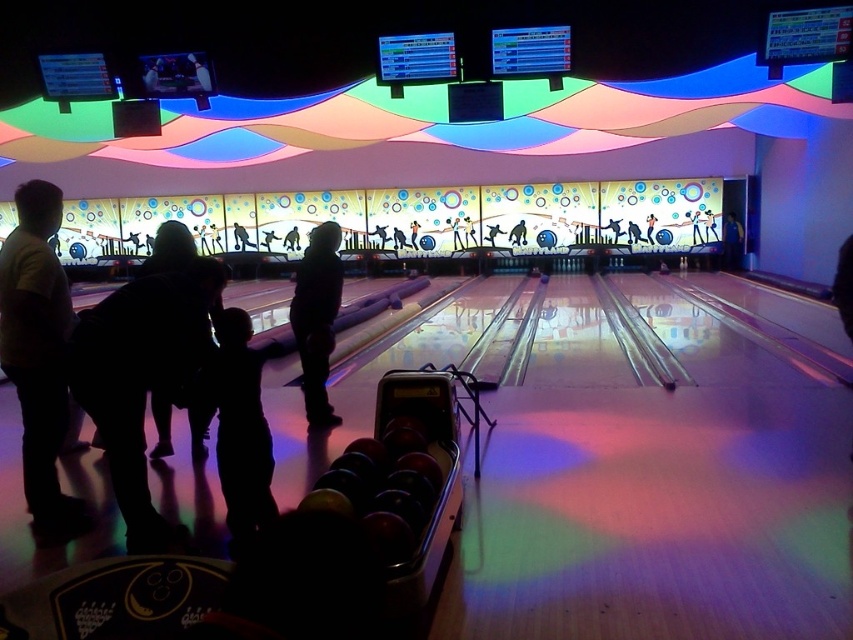
Can you confirm if dark clothing at left is positioned to the left of silhouette/shadow child at center?

Yes, dark clothing at left is to the left of silhouette/shadow child at center.

Is point (35, 280) less distant than point (253, 435)?

Yes.

This screenshot has width=853, height=640. What are the coordinates of `dark clothing at left` in the screenshot? It's located at (38, 353).

Locate an element on the screen. The height and width of the screenshot is (640, 853). dark clothing at left is located at coordinates (38, 353).

Between silhouette/shadow child at center and black matte clothing at center, which one has less height?

Standing shorter between the two is silhouette/shadow child at center.

Does silhouette/shadow child at center have a lesser width compared to black matte clothing at center?

No, silhouette/shadow child at center is not thinner than black matte clothing at center.

This screenshot has width=853, height=640. Describe the element at coordinates (241, 424) in the screenshot. I see `silhouette/shadow child at center` at that location.

At what (x,y) coordinates should I click in order to perform the action: click on silhouette/shadow child at center. Please return your answer as a coordinate pair (x, y). The height and width of the screenshot is (640, 853). Looking at the image, I should click on (241, 424).

Who is positioned more to the left, black matte bowling ball at left or black matte clothing at center?

From the viewer's perspective, black matte bowling ball at left appears more on the left side.

Is the position of black matte bowling ball at left less distant than that of black matte clothing at center?

Yes, black matte bowling ball at left is closer to the viewer.

Find the location of `black matte bowling ball at left`. black matte bowling ball at left is located at coordinates (144, 365).

Where is `black matte bowling ball at left`? This screenshot has height=640, width=853. black matte bowling ball at left is located at coordinates (144, 365).